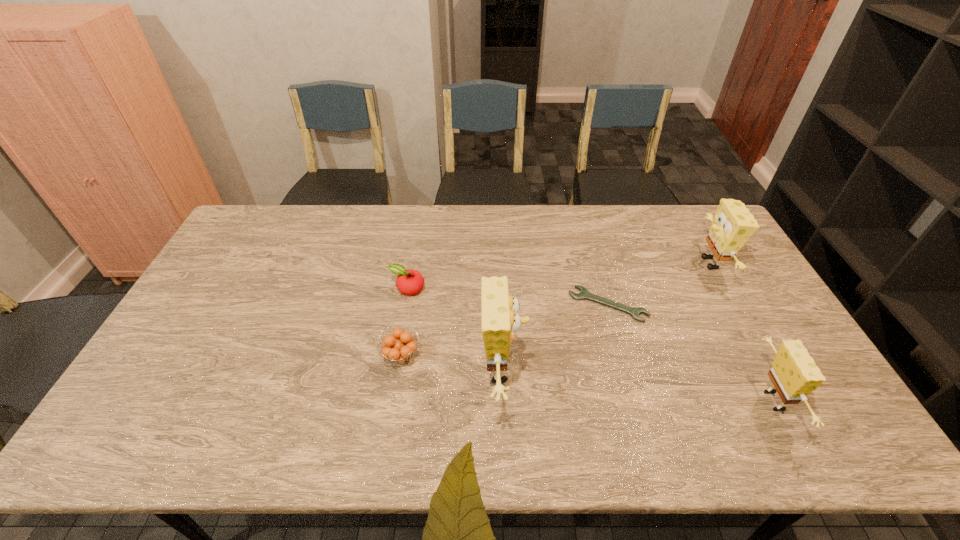
Find the location of a particular element. The width and height of the screenshot is (960, 540). vacant point located between the orange fruit and the apple is located at coordinates (404, 322).

In order to click on vacant space in between the leftmost sponge and the shortest sponge in this screenshot , I will do `click(639, 385)`.

Where is `empty space that is in between the apple and the fourth object from right to left`? empty space that is in between the apple and the fourth object from right to left is located at coordinates 455,329.

Identify which object is located as the fourth nearest to the fourth object from left to right. Please provide its 2D coordinates. Your answer should be formatted as a tuple, i.e. [(x, y)], where the tuple contains the x and y coordinates of a point satisfying the conditions above.

[(399, 353)]

Find the location of a particular element. the fifth closest object to the apple is located at coordinates [794, 374].

Locate an element on the screen. The image size is (960, 540). sponge identified as the closest to the shortest sponge is located at coordinates (733, 224).

This screenshot has height=540, width=960. In order to click on the second closest sponge to the apple in this screenshot , I will do `click(733, 224)`.

Find the location of a particular element. free point that satisfies the following two spatial constraints: 1. on the front side of the orange fruit; 2. on the left side of the apple is located at coordinates (396, 356).